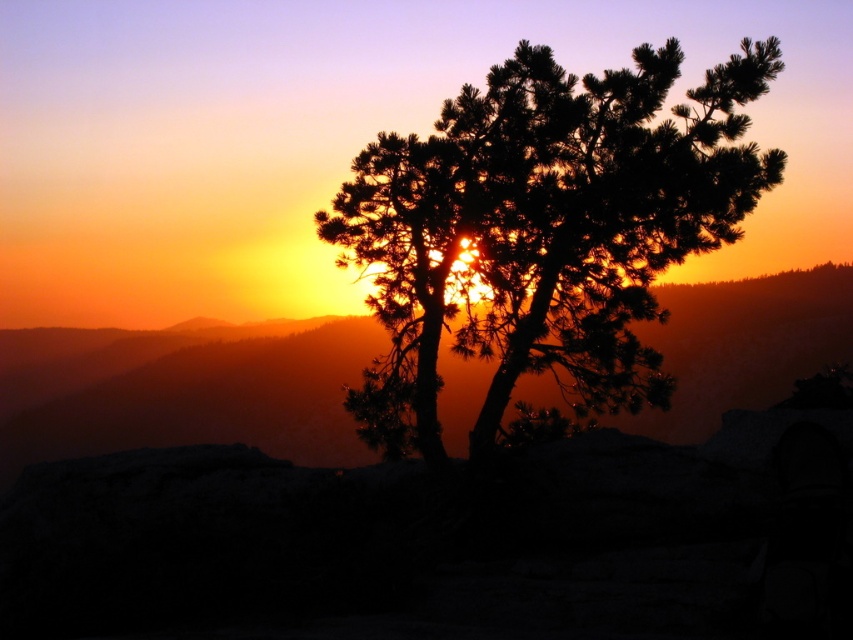
Question: Is silhouette pine at center to the right of matte orange mountain at center from the viewer's perspective?

Choices:
 (A) no
 (B) yes

Answer: (A)

Question: Among these points, which one is nearest to the camera?

Choices:
 (A) (264, 424)
 (B) (364, 173)

Answer: (B)

Question: Does silhouette pine at center come behind matte orange mountain at center?

Choices:
 (A) yes
 (B) no

Answer: (B)

Question: In this image, where is silhouette pine at center located relative to matte orange mountain at center?

Choices:
 (A) above
 (B) below

Answer: (A)

Question: Which point is farther to the camera?

Choices:
 (A) (645, 77)
 (B) (146, 385)

Answer: (B)